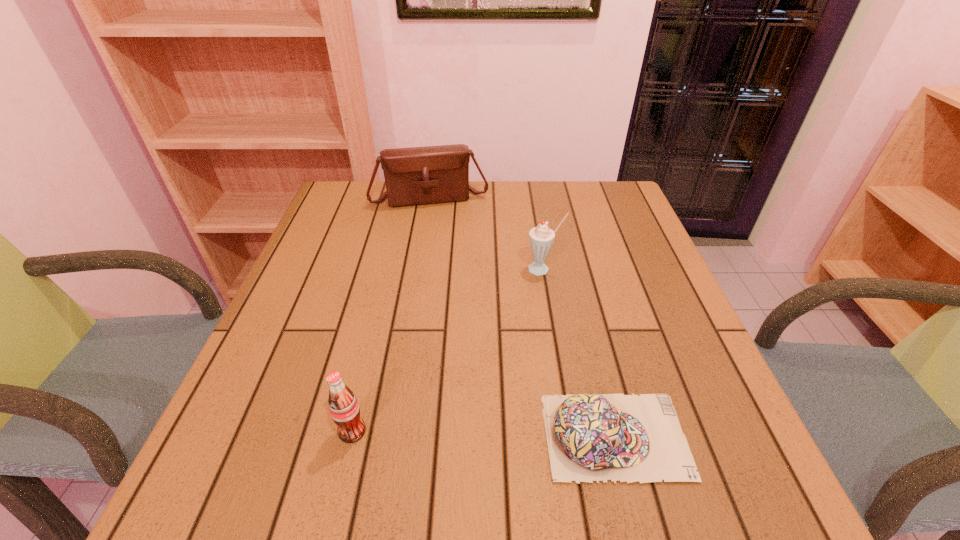
Locate an element on the screen. This screenshot has width=960, height=540. vacant space at the left edge of the desktop is located at coordinates (369, 244).

Where is `vacant space at the right edge of the desktop`? vacant space at the right edge of the desktop is located at coordinates (616, 312).

Locate an element on the screen. This screenshot has width=960, height=540. vacant region at the far left corner of the desktop is located at coordinates (349, 202).

In the image, there is a desktop. Identify the location of vacant space at the far right corner. Image resolution: width=960 pixels, height=540 pixels. (x=590, y=221).

Locate an element on the screen. Image resolution: width=960 pixels, height=540 pixels. free space between the milkshake and the farthest object is located at coordinates (487, 233).

Locate an element on the screen. vacant area that lies between the shoulder bag and the soda is located at coordinates click(x=392, y=314).

Where is `vacant space in between the cap and the milkshake`? The image size is (960, 540). vacant space in between the cap and the milkshake is located at coordinates (579, 353).

Locate an element on the screen. The image size is (960, 540). vacant space that is in between the cap and the shoulder bag is located at coordinates (522, 317).

This screenshot has height=540, width=960. I want to click on free area in between the shortest object and the soda, so click(484, 434).

This screenshot has width=960, height=540. I want to click on free spot between the farthest object and the soda, so click(x=392, y=314).